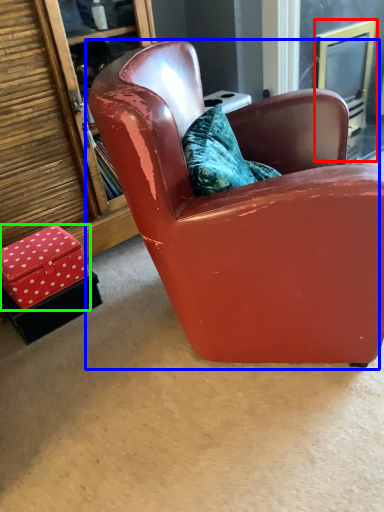
Question: Which object is the closest to the screen door (highlighted by a red box)? Choose among these: chair (highlighted by a blue box) or box (highlighted by a green box).

Choices:
 (A) chair
 (B) box

Answer: (A)